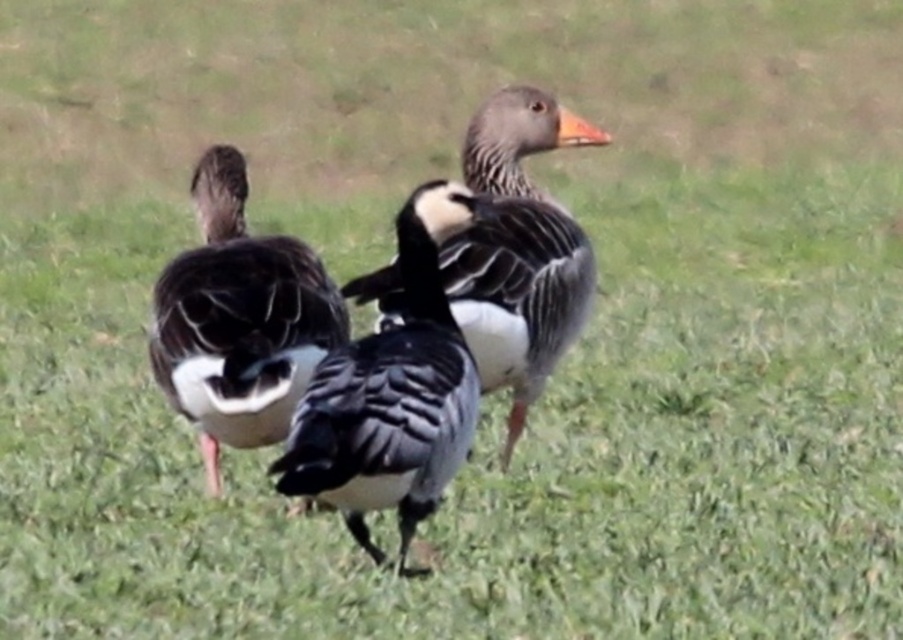
You are standing in the field and want to place a small flag at the point closer to you between point (431, 458) and point (550, 304). Which point should you choose?

You should choose point (431, 458) because it is closer to the viewer than point (550, 304).